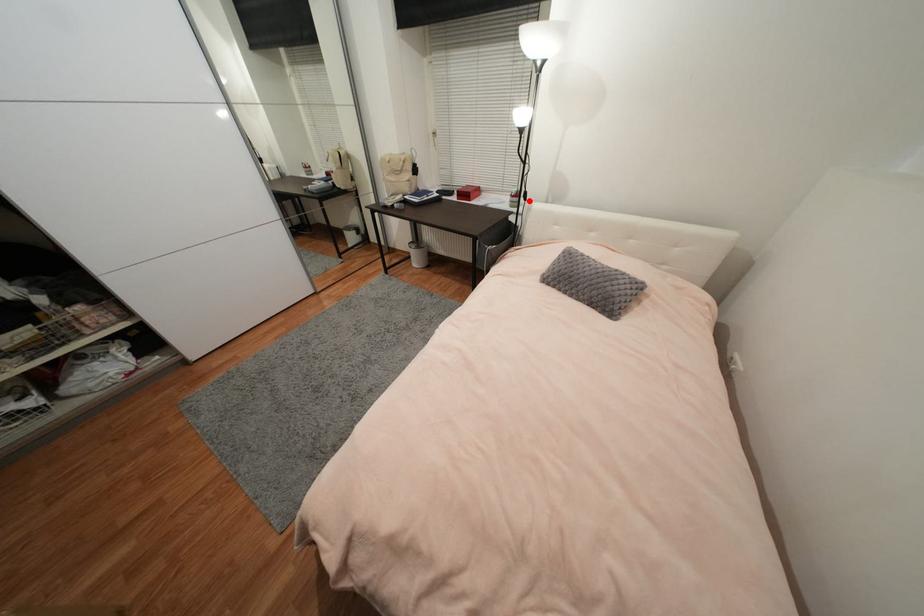
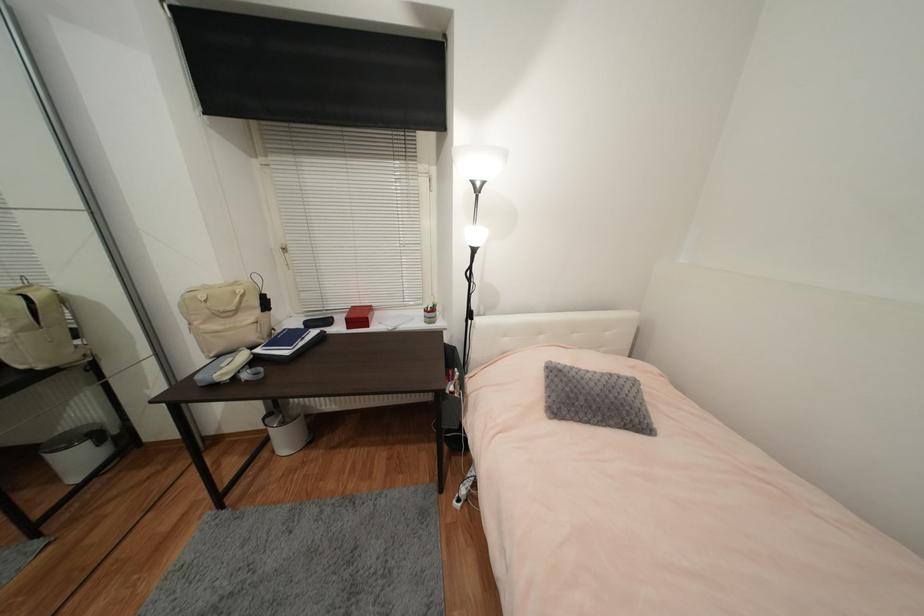
Question: I am providing you with two images of the same scene from different viewpoints. A red point is shown in image1. For the corresponding object point in image2, is it positioned nearer or farther from the camera?

Choices:
 (A) Nearer
 (B) Farther

Answer: (B)